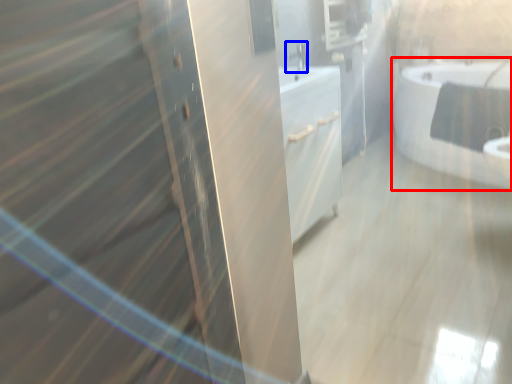
Question: Which of the following is the farthest to the observer, bathtub (highlighted by a red box) or faucet (highlighted by a blue box)?

Choices:
 (A) bathtub
 (B) faucet

Answer: (A)